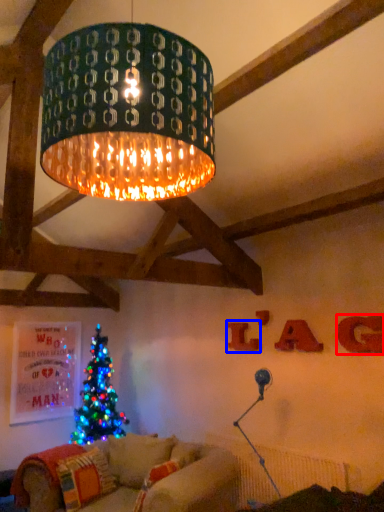
Question: Which object is further to the camera taking this photo, letter (highlighted by a red box) or letter (highlighted by a blue box)?

Choices:
 (A) letter
 (B) letter

Answer: (B)